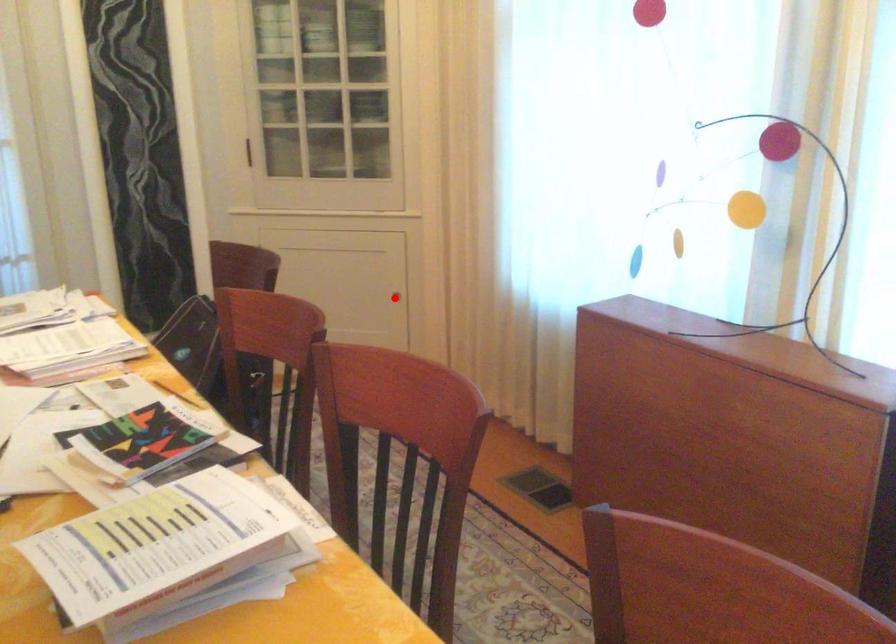
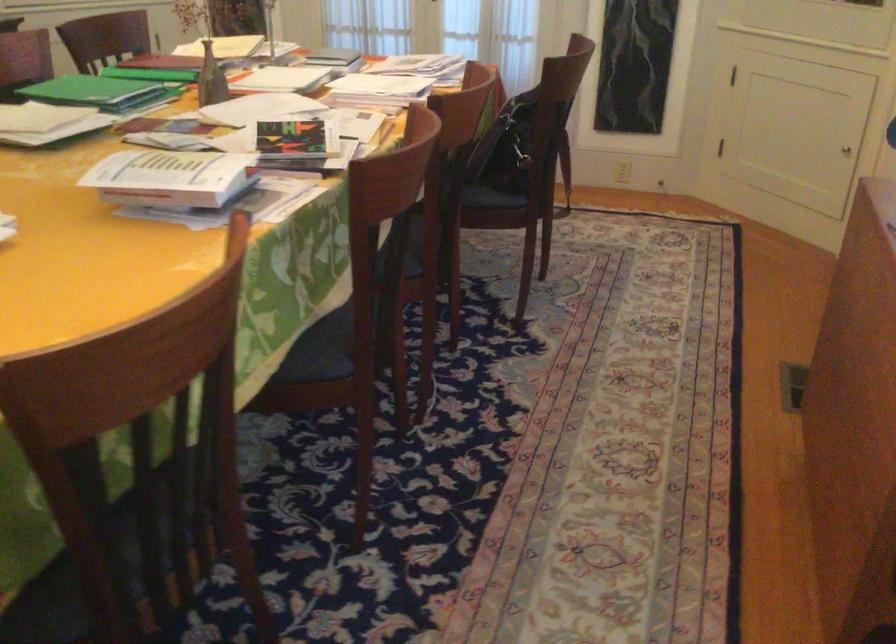
In the second image, find the point that corresponds to the highlighted location in the first image.

(846, 149)